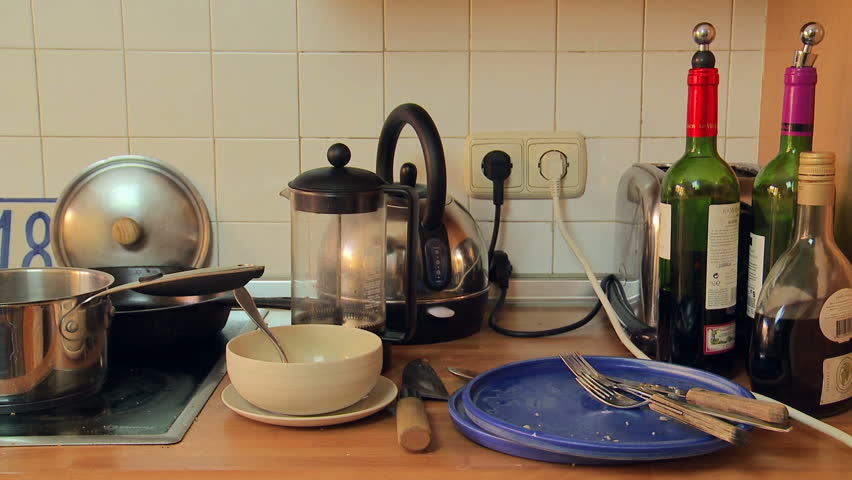
Locate an element on the screen. The width and height of the screenshot is (852, 480). pot is located at coordinates (37, 351).